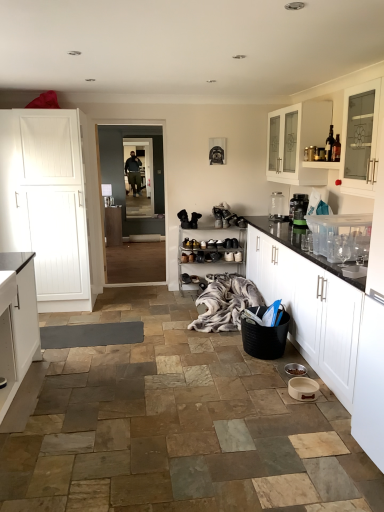
Question: Which is correct: black plastic basket at lower right is inside white wood door at left, the fourth cabinetry when ordered from front to back, or outside of it?

Choices:
 (A) outside
 (B) inside

Answer: (A)

Question: Based on their sizes in the image, would you say black plastic basket at lower right is bigger or smaller than white wood door at left, acting as the 6th cabinetry starting from the right?

Choices:
 (A) small
 (B) big

Answer: (A)

Question: Considering the real-world distances, which object is closest to the white matte cabinet at lower right, the fifth cabinetry from the back?

Choices:
 (A) white glass cabinet at upper right, placed as the fifth cabinetry when sorted from left to right
 (B) gray woolen blanket at lower center
 (C) white matte cabinet at lower left, acting as the third cabinetry starting from the left
 (D) white wood cabinet at center, arranged as the 2th cabinetry when viewed from the left
 (E) black plastic basket at lower right

Answer: (E)

Question: Based on their relative distances, which object is nearer to the transparent glass water bottle at upper right?

Choices:
 (A) white glass cabinet at upper right, the 5th cabinetry in the front-to-back sequence
 (B) leather shoe at center
 (C) black plastic basket at lower right
 (D) transparent glass door at center
 (E) white wood door at left, the fourth cabinetry when ordered from front to back

Answer: (A)